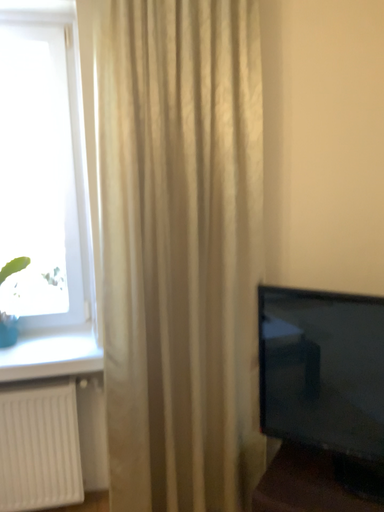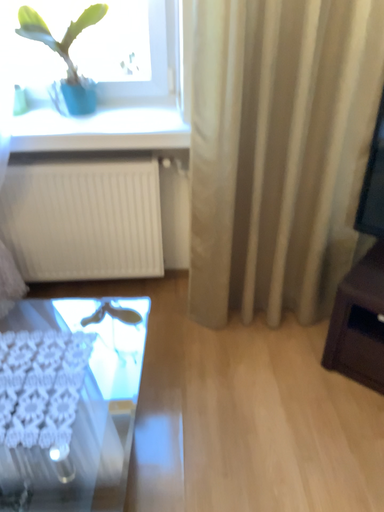
Question: How did the camera likely rotate when shooting the video?

Choices:
 (A) rotated downward
 (B) rotated upward

Answer: (A)